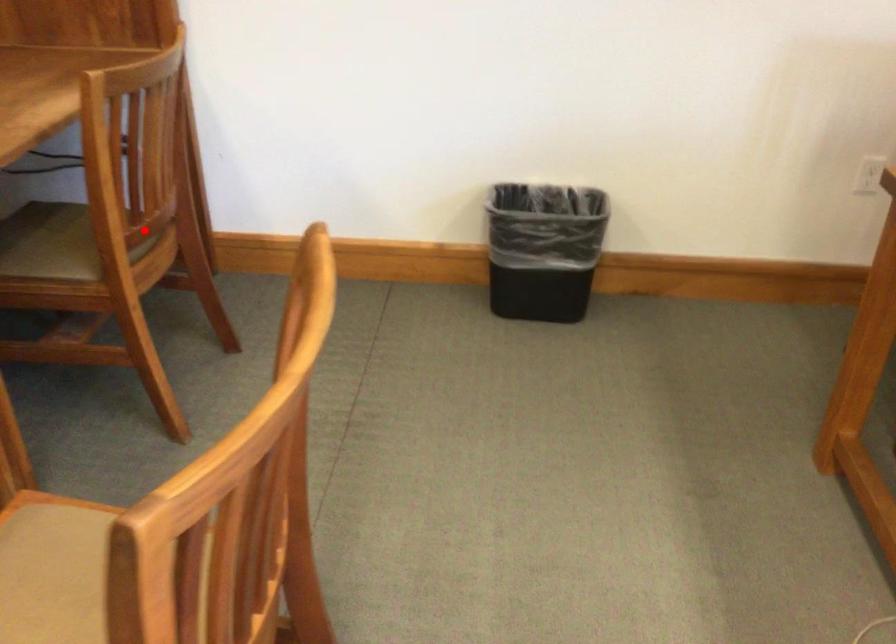
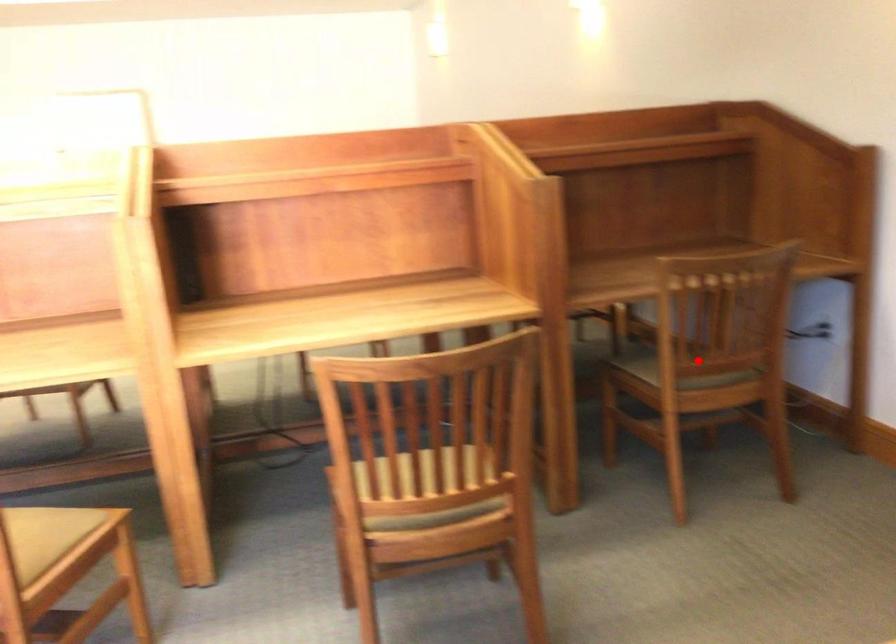
I am providing you with two images of the same scene from different viewpoints. A red point is marked on the first image and another point is marked on the second image. Does the point marked in image1 correspond to the same location as the one in image2?

Yes